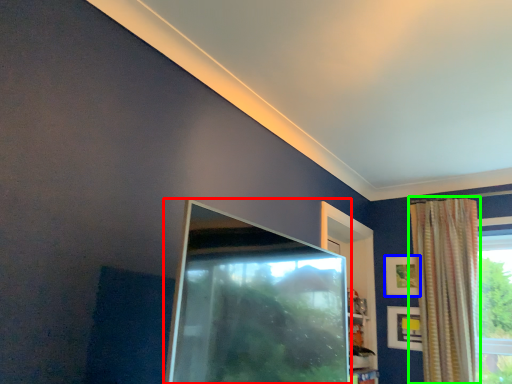
Question: Which object is the closest to the screen door (highlighted by a red box)? Choose among these: picture frame (highlighted by a blue box) or curtain (highlighted by a green box).

Choices:
 (A) picture frame
 (B) curtain

Answer: (B)